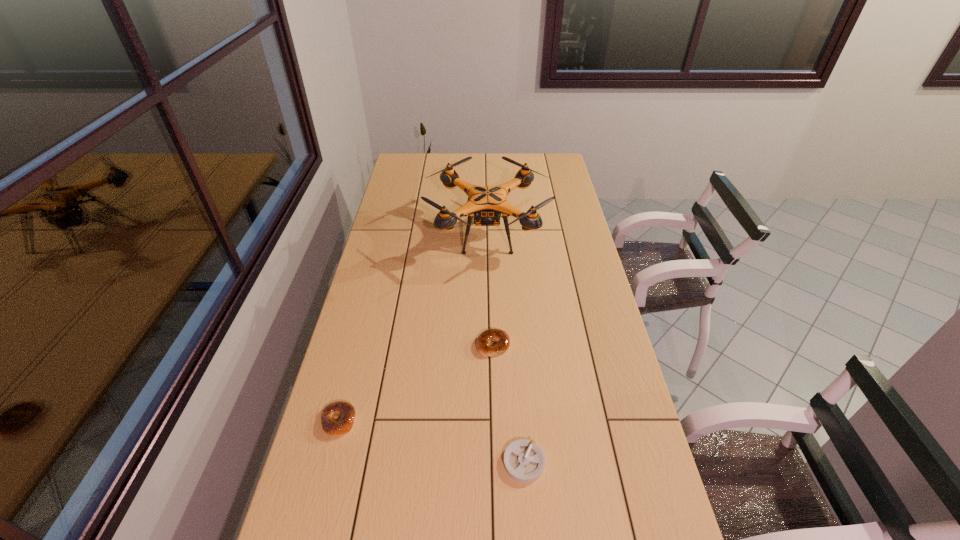
What are the coordinates of `free location located on the left of the third nearest object` in the screenshot? It's located at (420, 345).

The width and height of the screenshot is (960, 540). Identify the location of vacant space located 0.280m on the back of the leftmost object. (363, 330).

Find the location of `free location located on the left of the nearest object`. free location located on the left of the nearest object is located at coordinates (414, 462).

Where is `object present at the left edge`? The width and height of the screenshot is (960, 540). object present at the left edge is located at coordinates (346, 411).

The width and height of the screenshot is (960, 540). In order to click on object that is at the right edge in this screenshot , I will do `click(487, 203)`.

This screenshot has height=540, width=960. What are the coordinates of `vacant space at the far edge of the desktop` in the screenshot? It's located at (487, 170).

Locate an element on the screen. free region at the left edge of the desktop is located at coordinates (397, 276).

In the image, there is a desktop. Where is `free region at the right edge`? free region at the right edge is located at coordinates (552, 245).

Find the location of a particular element. This screenshot has width=960, height=540. free spot between the farther bagel and the nearer bagel is located at coordinates (416, 383).

This screenshot has width=960, height=540. What are the coordinates of `free space between the right bagel and the leftmost object` in the screenshot? It's located at (416, 383).